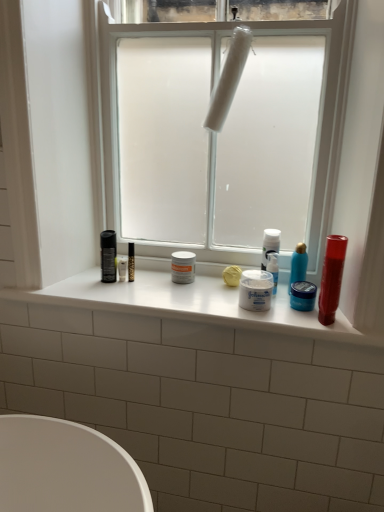
The width and height of the screenshot is (384, 512). I want to click on free location in front of blue matte jar at center, which is the third toiletry in left-to-right order, so click(317, 321).